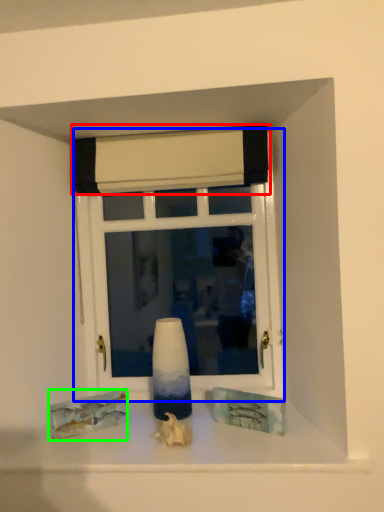
Question: Which object is positioned farthest from curtain (highlighted by a red box)? Select from window (highlighted by a blue box) and art (highlighted by a green box).

Choices:
 (A) window
 (B) art

Answer: (B)